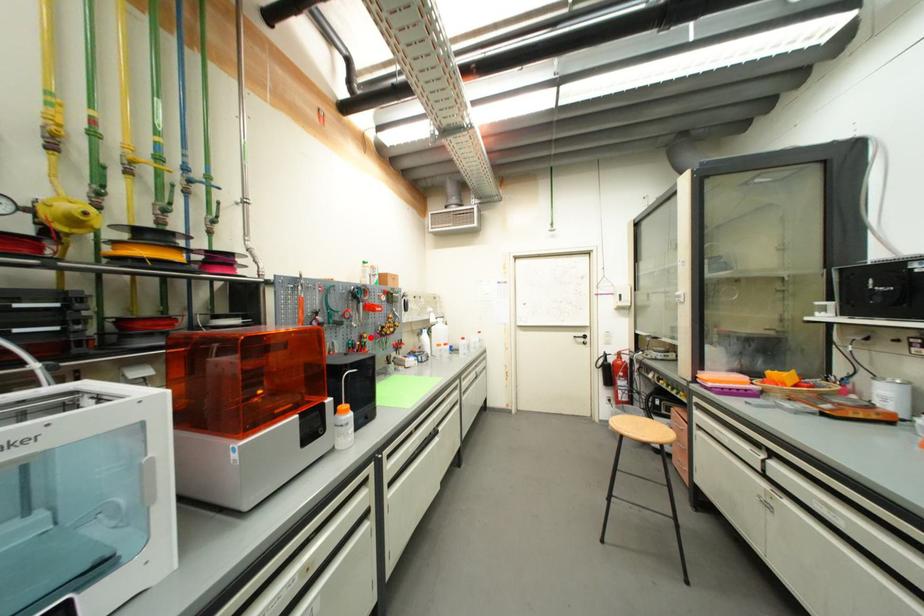
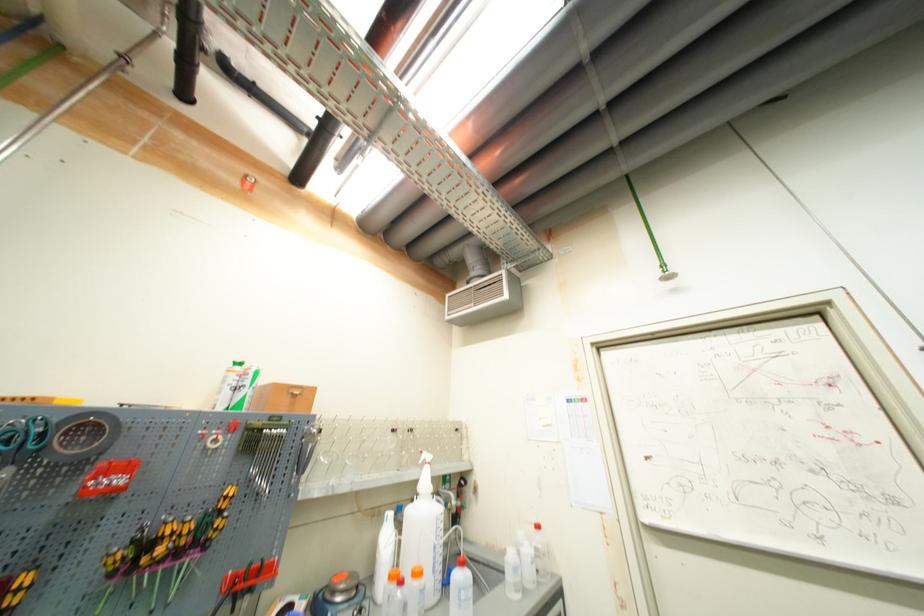
The point at the highlighted location is marked in the first image. Where is the corresponding point in the second image?

(30, 581)